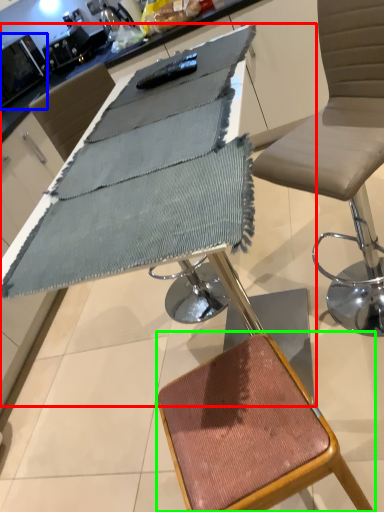
Question: Which object is positioned closest to table (highlighted by a red box)? Select from appliance (highlighted by a blue box) and stool (highlighted by a green box).

Choices:
 (A) appliance
 (B) stool

Answer: (B)